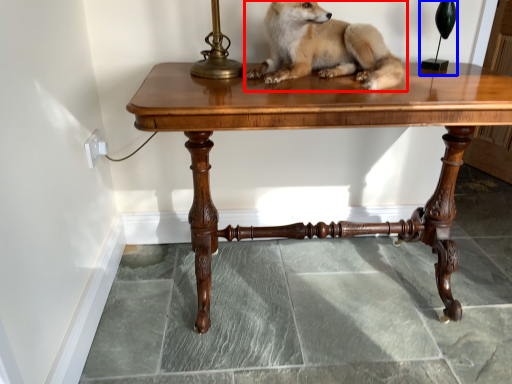
Question: Which object appears closest to the camera in this image, dog (highlighted by a red box) or table lamp (highlighted by a blue box)?

Choices:
 (A) dog
 (B) table lamp

Answer: (A)